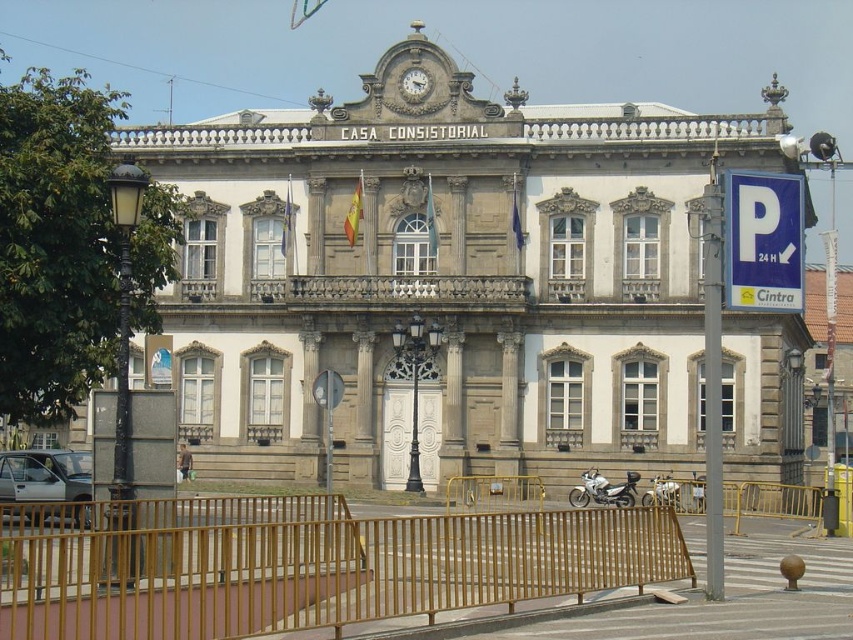
Does blue plastic parking sign at upper right have a lesser height compared to gold textured clock at upper center?

Yes, blue plastic parking sign at upper right is shorter than gold textured clock at upper center.

Who is more distant from viewer, (732,257) or (407,81)?

The point (407,81) is more distant.

Image resolution: width=853 pixels, height=640 pixels. I want to click on blue plastic parking sign at upper right, so click(x=763, y=241).

At what (x,y) coordinates should I click in order to perform the action: click on blue plastic parking sign at upper right. Please return your answer as a coordinate pair (x, y). The height and width of the screenshot is (640, 853). Looking at the image, I should click on (763, 241).

How far apart are blue plastic parking sign at upper right and silver metallic motorcycle at center?

blue plastic parking sign at upper right is 18.50 meters from silver metallic motorcycle at center.

The width and height of the screenshot is (853, 640). Identify the location of blue plastic parking sign at upper right. (763, 241).

This screenshot has height=640, width=853. In order to click on blue plastic parking sign at upper right in this screenshot , I will do `click(763, 241)`.

Between stone building at center and white metallic motorcycle at center, which one is positioned lower?

Positioned lower is white metallic motorcycle at center.

Is point (397, 410) positioned in front of point (567, 499)?

No, it is not.

The height and width of the screenshot is (640, 853). Identify the location of stone building at center. (445, 276).